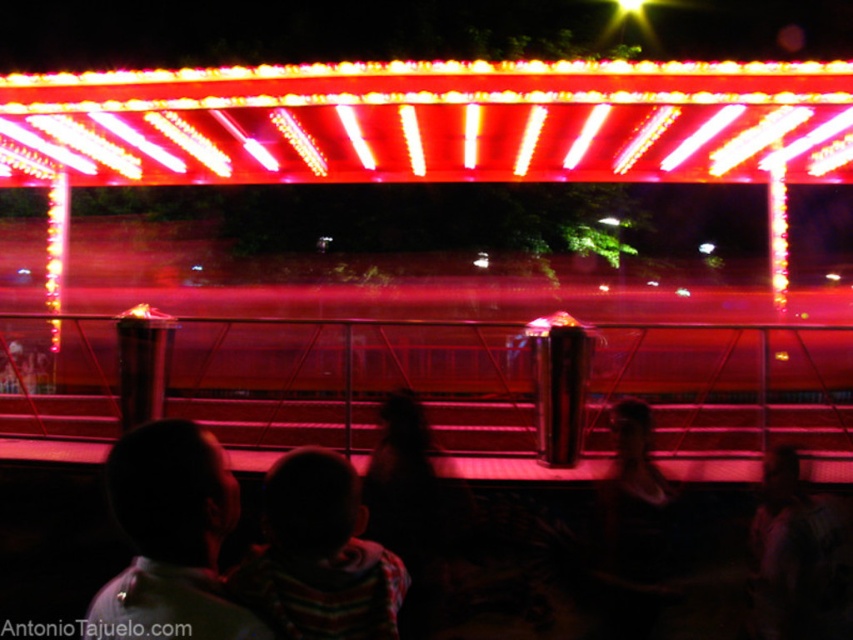
Question: Where is bright red neon lights at upper center located in relation to striped sweater at center in the image?

Choices:
 (A) left
 (B) right

Answer: (A)

Question: Which object appears farthest from the camera in this image?

Choices:
 (A) dark hair at lower left
 (B) bright red neon lights at upper center

Answer: (B)

Question: Can you confirm if bright red neon lights at upper center is wider than dark hair at lower left?

Choices:
 (A) no
 (B) yes

Answer: (B)

Question: Which object is closer to the camera taking this photo?

Choices:
 (A) dark hair at lower left
 (B) striped sweater at center
 (C) bright red neon lights at upper center

Answer: (A)

Question: Which object is farther from the camera taking this photo?

Choices:
 (A) bright red neon lights at upper center
 (B) striped sweater at center

Answer: (A)

Question: Does bright red neon lights at upper center have a smaller size compared to dark hair at lower left?

Choices:
 (A) yes
 (B) no

Answer: (A)